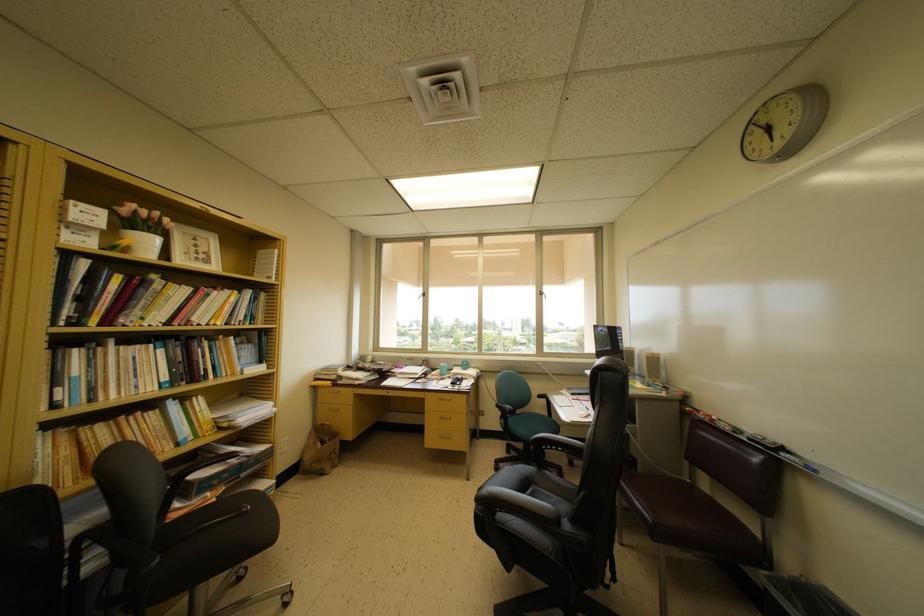
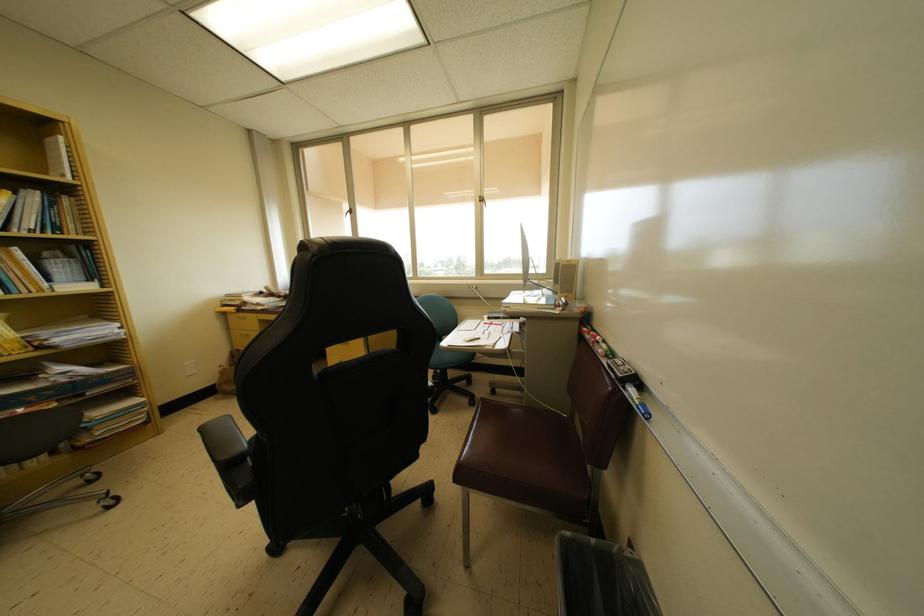
Find the pixel in the second image that matches (237,305) in the first image.

(7, 206)